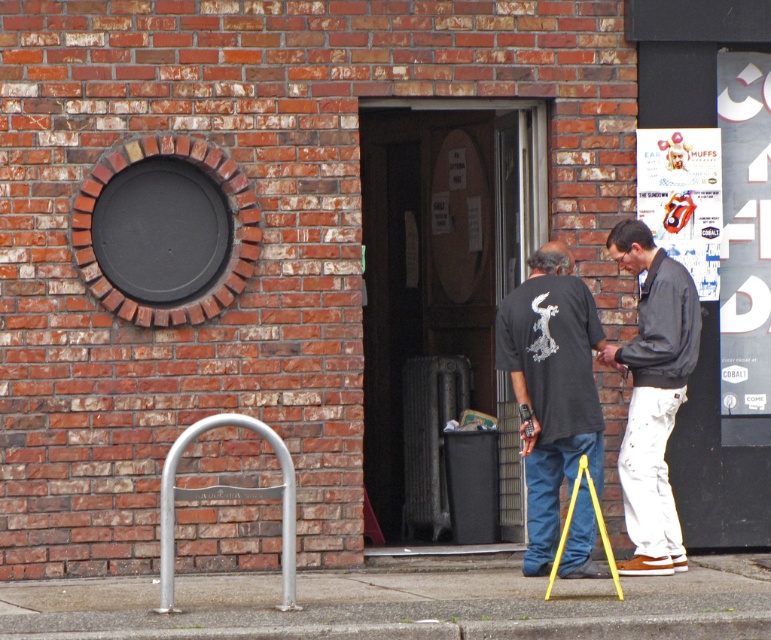
In the scene shown: You are a photographer holding a camera and standing near the yellow plastic tripod at lower center. You want to take a photo of the light gray cotton jacket at right without any obstructions. Can you do this directly, or will the tripod block your view?

The light gray cotton jacket at right is further to the viewer than the yellow plastic tripod at lower center, so the tripod will block your view. Move the tripod or reposition yourself to capture the jacket without obstruction.

You are standing outside the building and want to know where the light gray cotton jacket at right is located. Can you describe its position relative to the circular window?

The light gray cotton jacket at right is located to the right of the circular window, as its 2D coordinates at point [652,396] place it in that direction relative to the window.

Looking at this image, you are a delivery person trying to place a heavy box on the ground. The box is too big to hold, so you need to put it down immediately. You see the concrete at lower center and the yellow plastic tripod at lower center. Which surface should you choose to place the box?

The concrete at lower center has a larger size compared to the yellow plastic tripod at lower center, so you should place the box on the concrete at lower center because it can accommodate the box better due to its larger surface area.